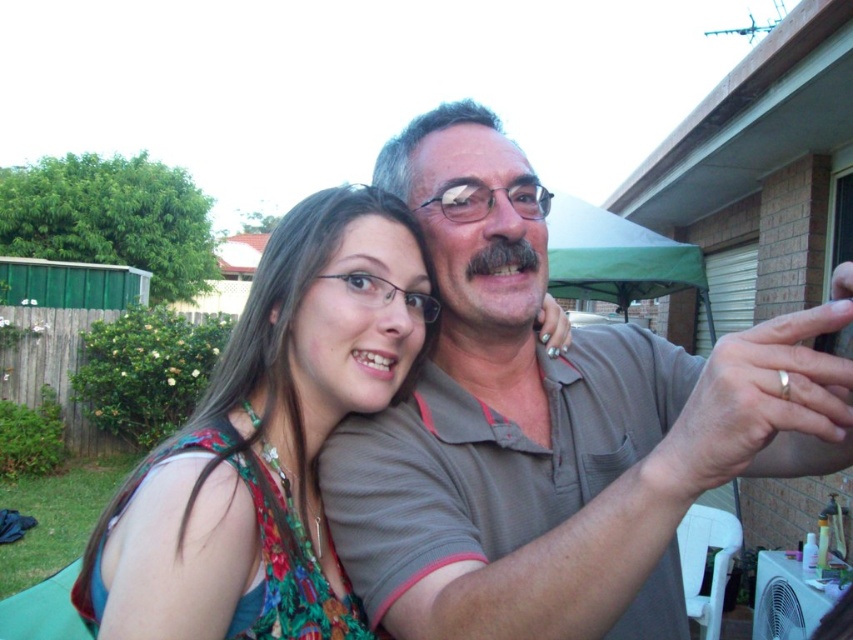
Question: Among these objects, which one is nearest to the camera?

Choices:
 (A) floral fabric dress at center
 (B) gray cotton shirt at center

Answer: (B)

Question: Can you confirm if gray cotton shirt at center is bigger than floral fabric dress at center?

Choices:
 (A) yes
 (B) no

Answer: (A)

Question: Can you confirm if gray cotton shirt at center is positioned above floral fabric dress at center?

Choices:
 (A) no
 (B) yes

Answer: (A)

Question: Does gray cotton shirt at center appear over floral fabric dress at center?

Choices:
 (A) yes
 (B) no

Answer: (B)